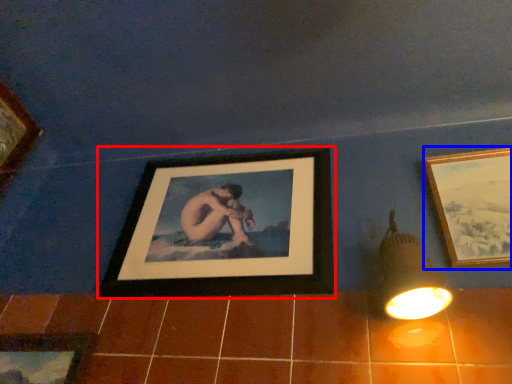
Question: Among these objects, which one is farthest to the camera, picture frame (highlighted by a red box) or picture frame (highlighted by a blue box)?

Choices:
 (A) picture frame
 (B) picture frame

Answer: (A)